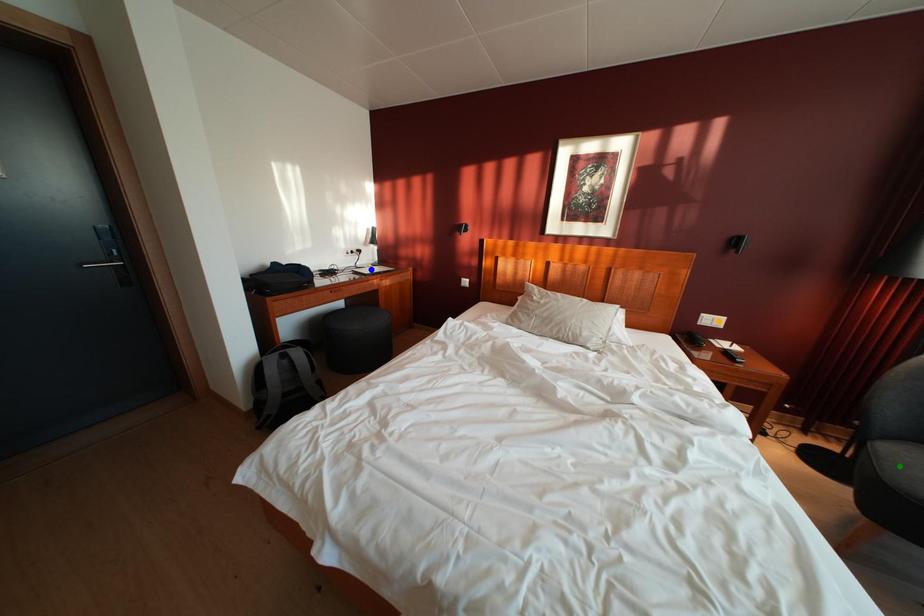
Order these from nearest to farthest:
1. green point
2. orange point
3. blue point

green point < orange point < blue point